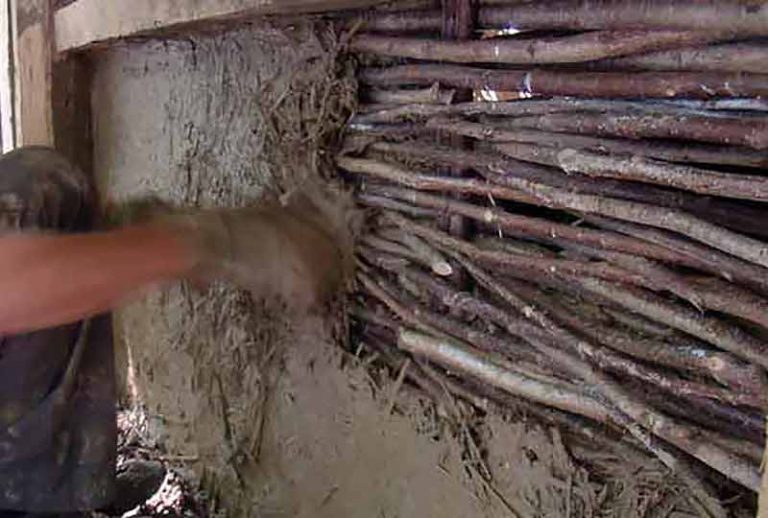
Locate an element on the screen. wooden beam is located at coordinates (101, 22).